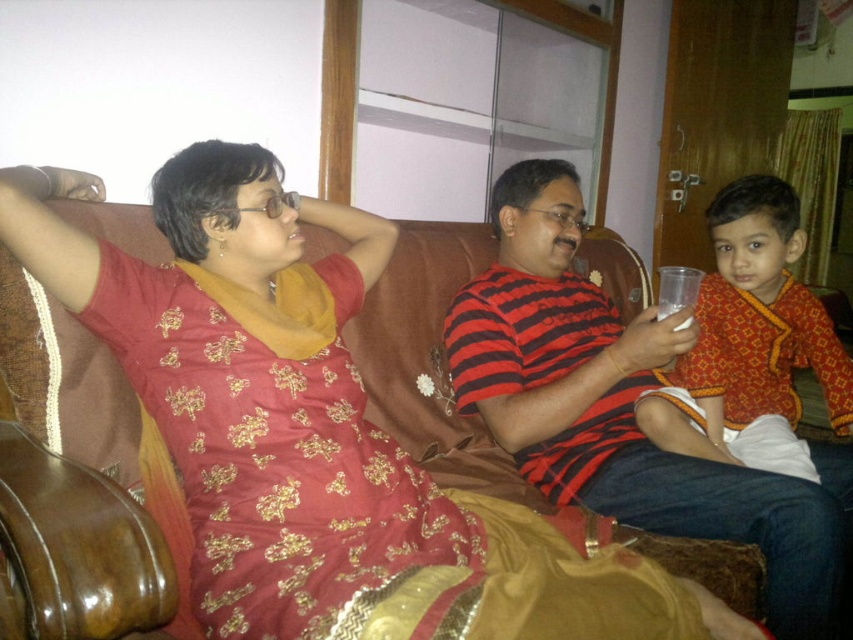
Question: Estimate the real-world distances between objects in this image. Which object is farther from the brown leather couch at center?

Choices:
 (A) matte orange shirt at right
 (B) striped cotton shirt at center
 (C) clear plastic cup at center

Answer: (A)

Question: Is brown leather couch at center positioned behind clear plastic cup at center?

Choices:
 (A) no
 (B) yes

Answer: (A)

Question: Which point is farther from the camera taking this photo?

Choices:
 (A) (83, 253)
 (B) (781, 634)
 (C) (675, 301)

Answer: (C)

Question: Does brown leather couch at center lie in front of striped cotton shirt at center?

Choices:
 (A) yes
 (B) no

Answer: (A)

Question: Based on their relative distances, which object is nearer to the clear plastic cup at center?

Choices:
 (A) brown leather couch at center
 (B) matte orange shirt at right
 (C) striped cotton shirt at center

Answer: (C)

Question: Can you confirm if brown leather couch at center is positioned to the right of clear plastic cup at center?

Choices:
 (A) yes
 (B) no

Answer: (B)